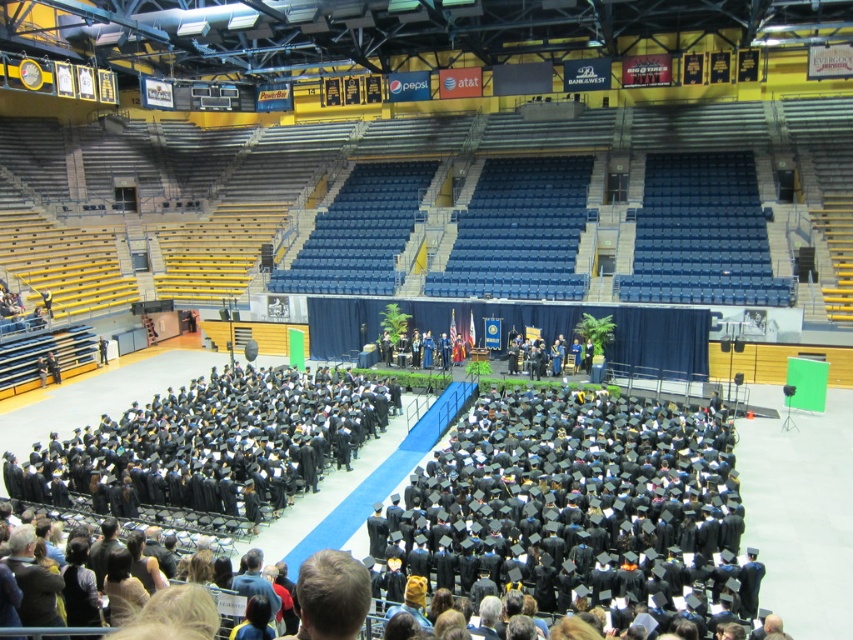
Could you measure the distance between black matte graduation gowns at center and black matte graduation gowns at lower left?

The distance of black matte graduation gowns at center from black matte graduation gowns at lower left is 18.65 feet.

Is point (622, 448) farther from viewer compared to point (236, 426)?

No, it is not.

Locate an element on the screen. The height and width of the screenshot is (640, 853). black matte graduation gowns at center is located at coordinates (578, 513).